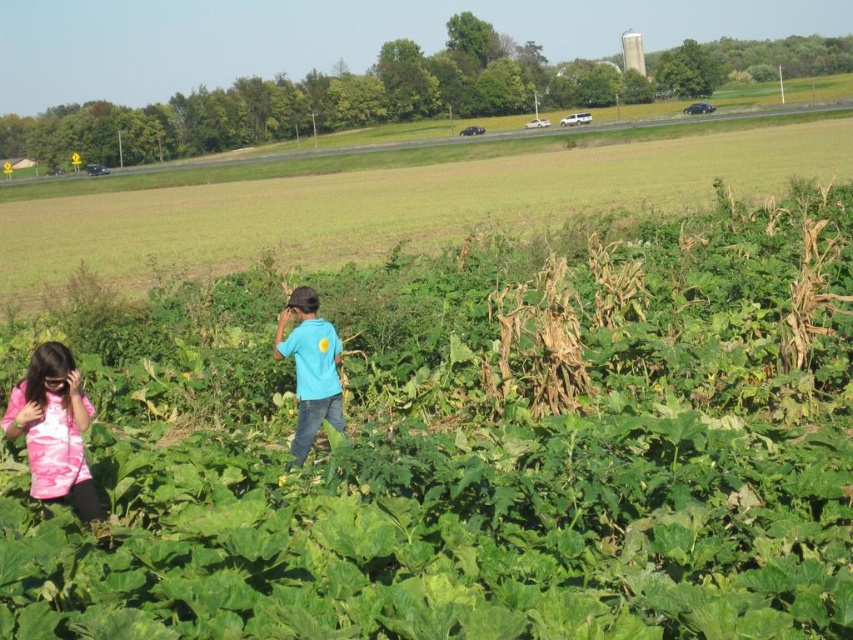
Question: Which object is closer to the camera taking this photo?

Choices:
 (A) matte blue shirt at center
 (B) green leafy plant at center

Answer: (B)

Question: Which object is the farthest from the pink tie-dye shirt at lower left?

Choices:
 (A) green leafy plant at center
 (B) matte blue shirt at center

Answer: (A)

Question: Based on their relative distances, which object is farther from the pink tie-dye shirt at lower left?

Choices:
 (A) matte blue shirt at center
 (B) green leafy plant at center

Answer: (B)

Question: Considering the relative positions of green leafy plant at center and matte blue shirt at center in the image provided, where is green leafy plant at center located with respect to matte blue shirt at center?

Choices:
 (A) below
 (B) above

Answer: (B)

Question: Is pink tie-dye shirt at lower left wider than matte blue shirt at center?

Choices:
 (A) no
 (B) yes

Answer: (B)

Question: Can you confirm if green leafy plant at center is positioned to the right of matte blue shirt at center?

Choices:
 (A) yes
 (B) no

Answer: (A)